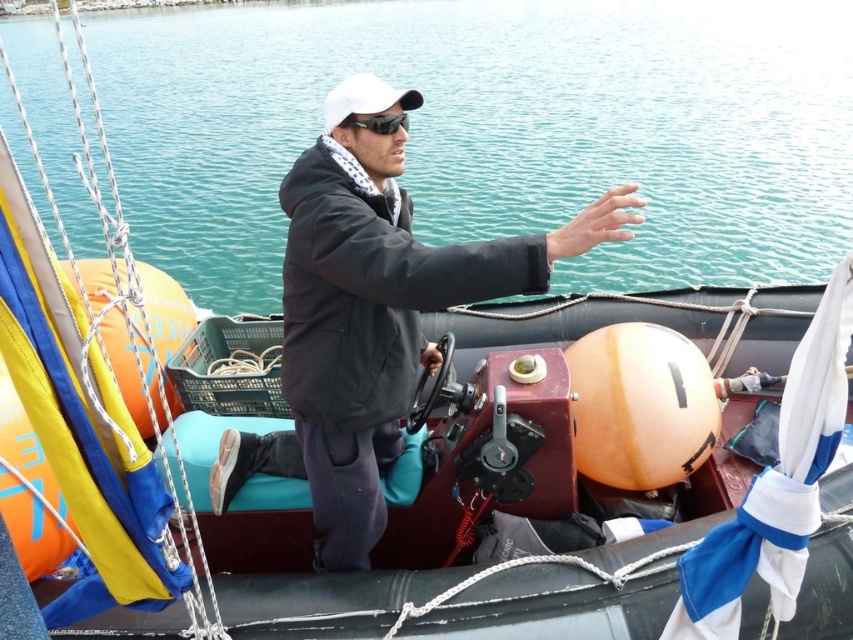
You are a passenger on the boat and want to point out the turquoise water at center to the captain. Which direction should you indicate relative to the black matte jacket at center?

The turquoise water at center is to the right of the black matte jacket at center, so you should indicate the right direction relative to the black matte jacket at center.

You are a passenger on the boat and want to know if the black matte sunglasses at upper center are positioned higher than the turquoise water at center. Based on the scene, can you determine this?

The turquoise water at center is above black matte sunglasses at upper center, so the sunglasses are positioned lower than the water.

You are a fashion designer observing a person wearing a black matte jacket at center and a white matte baseball cap at center. Which clothing item has a smaller width?

The black matte jacket at center has a smaller width than the white matte baseball cap at center.